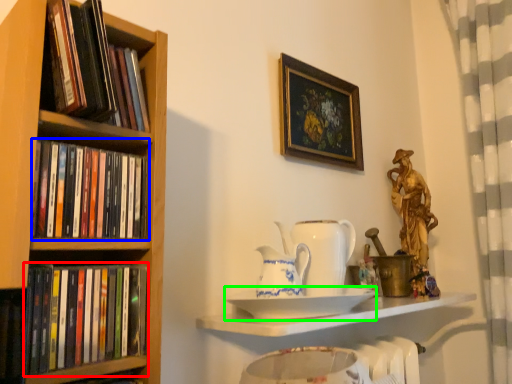
Question: Which object is the closest to the book (highlighted by a red box)? Choose among these: book (highlighted by a blue box) or plate (highlighted by a green box).

Choices:
 (A) book
 (B) plate

Answer: (A)